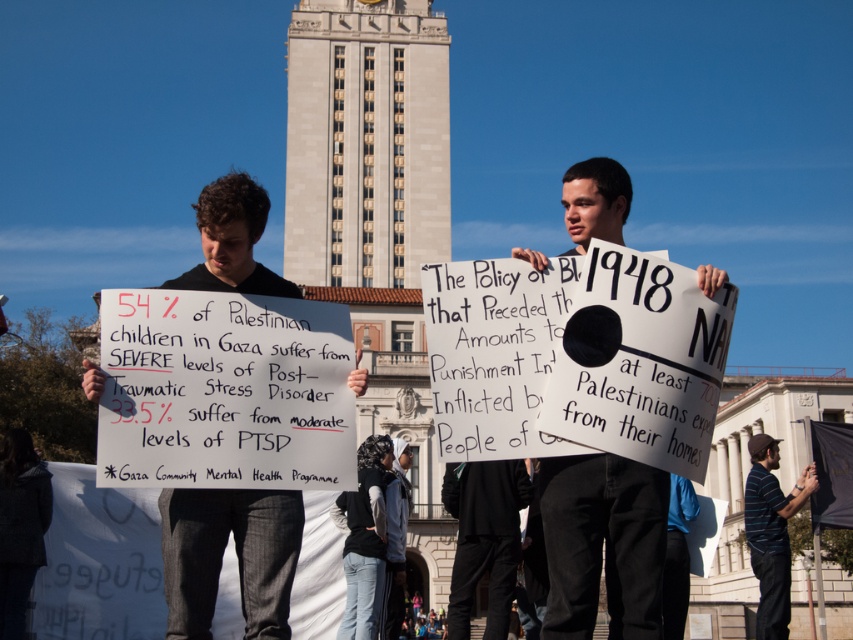
Question: Does white paper sign at center have a smaller size compared to black cotton pants at lower center?

Choices:
 (A) yes
 (B) no

Answer: (B)

Question: Which point is closer to the camera?

Choices:
 (A) black fabric shirt at center
 (B) striped polo shirt at lower right
 (C) black cotton pants at lower center

Answer: (A)

Question: Among these points, which one is nearest to the camera?

Choices:
 (A) (624, 221)
 (B) (525, 496)
 (C) (747, 532)

Answer: (A)

Question: Is black cotton pants at lower center positioned before striped polo shirt at lower right?

Choices:
 (A) no
 (B) yes

Answer: (B)

Question: Can you confirm if white paper sign at center is positioned below black fabric shirt at center?

Choices:
 (A) yes
 (B) no

Answer: (A)

Question: Which point is closer to the camera?

Choices:
 (A) black fabric shirt at center
 (B) striped polo shirt at lower right
 (C) black cotton pants at lower center
 (D) white paper sign at center

Answer: (D)